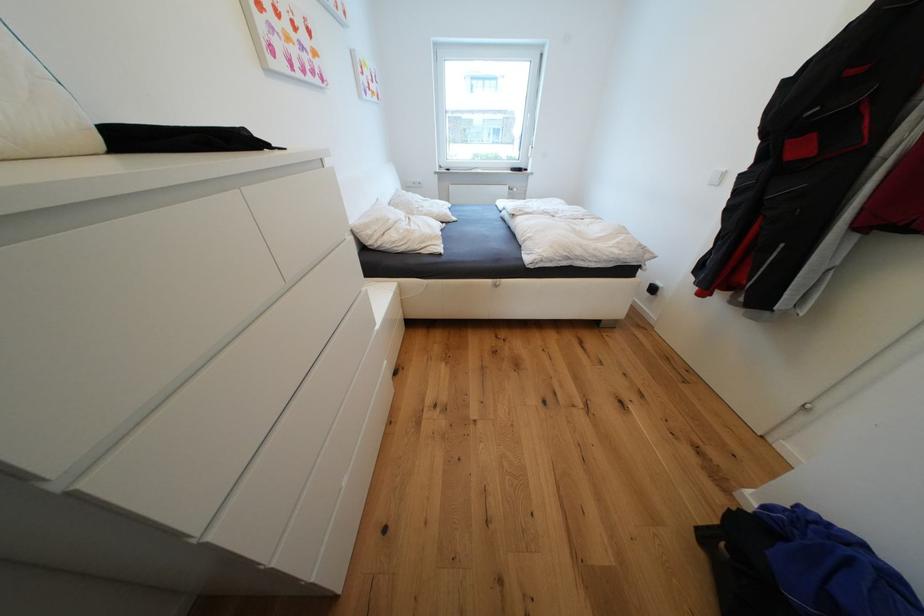
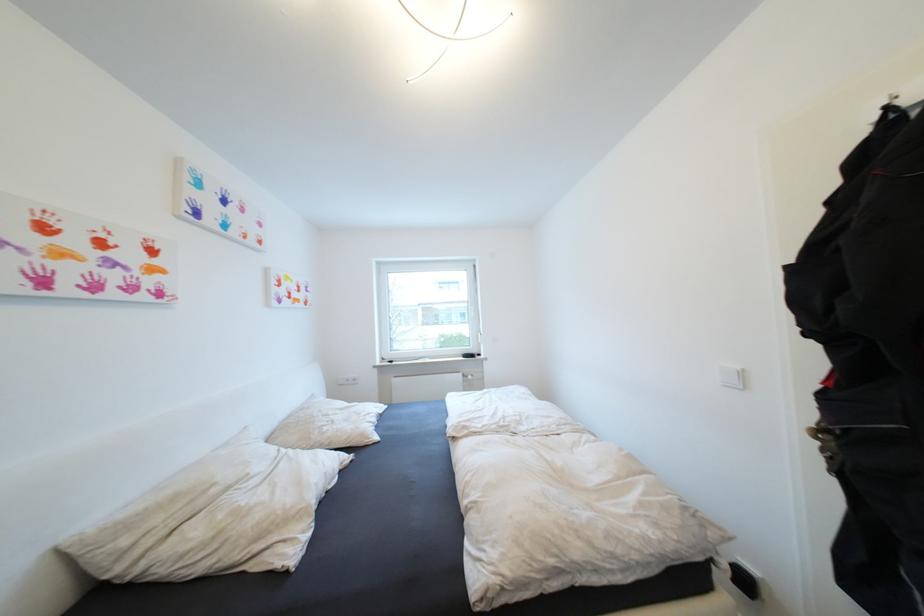
Question: The images are taken continuously from a first-person perspective. In which direction is your viewpoint rotating?

Choices:
 (A) Left
 (B) Right
 (C) Up
 (D) Down

Answer: (C)